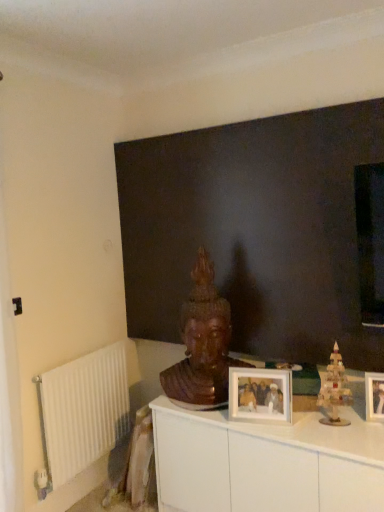
Question: Can you confirm if dark matte wall at center is bigger than wooden christmas tree at right?

Choices:
 (A) yes
 (B) no

Answer: (A)

Question: Is dark matte wall at center at the left side of wooden christmas tree at right?

Choices:
 (A) no
 (B) yes

Answer: (B)

Question: Considering the relative sizes of dark matte wall at center and wooden christmas tree at right in the image provided, is dark matte wall at center shorter than wooden christmas tree at right?

Choices:
 (A) no
 (B) yes

Answer: (A)

Question: From a real-world perspective, is dark matte wall at center over wooden christmas tree at right?

Choices:
 (A) no
 (B) yes

Answer: (B)

Question: Can you confirm if dark matte wall at center is thinner than wooden christmas tree at right?

Choices:
 (A) yes
 (B) no

Answer: (B)

Question: From the image's perspective, is dark matte wall at center located above wooden christmas tree at right?

Choices:
 (A) yes
 (B) no

Answer: (A)

Question: Can you confirm if wooden picture frame at center, the 1th picture frame viewed from the right, is bigger than wooden statue at center?

Choices:
 (A) no
 (B) yes

Answer: (A)

Question: From the image's perspective, is wooden picture frame at center, acting as the second picture frame starting from the left, below wooden statue at center?

Choices:
 (A) no
 (B) yes

Answer: (B)

Question: Is wooden picture frame at center, acting as the second picture frame starting from the left, at the left side of wooden statue at center?

Choices:
 (A) no
 (B) yes

Answer: (A)

Question: From a real-world perspective, is wooden picture frame at center, the 1th picture frame viewed from the right, on wooden statue at center?

Choices:
 (A) no
 (B) yes

Answer: (A)

Question: Would you say wooden picture frame at center, acting as the second picture frame starting from the left, is outside wooden statue at center?

Choices:
 (A) no
 (B) yes

Answer: (B)

Question: Does wooden picture frame at center, acting as the second picture frame starting from the left, have a lesser width compared to wooden statue at center?

Choices:
 (A) yes
 (B) no

Answer: (A)

Question: Considering the relative sizes of wooden christmas tree at right and wooden picture frame at center, the 1th picture frame viewed from the right, in the image provided, is wooden christmas tree at right wider than wooden picture frame at center, the 1th picture frame viewed from the right,?

Choices:
 (A) no
 (B) yes

Answer: (B)